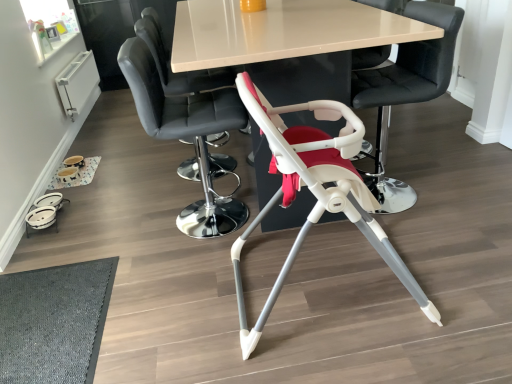
Question: Considering the relative sizes of smooth leather chair at upper center, which is the first chair in left-to-right order, and smooth black chair at center, which is the 3th chair in right-to-left order, in the image provided, is smooth leather chair at upper center, which is the first chair in left-to-right order, thinner than smooth black chair at center, which is the 3th chair in right-to-left order,?

Choices:
 (A) yes
 (B) no

Answer: (A)

Question: Can you confirm if smooth leather chair at upper center, the fourth chair when ordered from right to left, is taller than smooth black chair at center, which is the 3th chair in right-to-left order?

Choices:
 (A) yes
 (B) no

Answer: (A)

Question: Is smooth leather chair at upper center, the fourth chair when ordered from right to left, wider than smooth black chair at center, which is the 3th chair in right-to-left order?

Choices:
 (A) yes
 (B) no

Answer: (B)

Question: Is the position of smooth leather chair at upper center, which is the first chair in left-to-right order, more distant than that of smooth black chair at center, the second chair when ordered from left to right?

Choices:
 (A) yes
 (B) no

Answer: (A)

Question: Does smooth leather chair at upper center, the fourth chair when ordered from right to left, have a smaller size compared to smooth black chair at center, which is the 3th chair in right-to-left order?

Choices:
 (A) no
 (B) yes

Answer: (B)

Question: Looking at their shapes, would you say smooth black chair at center, the second chair when ordered from left to right, is wider or thinner than white glossy table at center?

Choices:
 (A) thin
 (B) wide

Answer: (A)

Question: Is smooth black chair at center, the second chair when ordered from left to right, in front of or behind white glossy table at center in the image?

Choices:
 (A) behind
 (B) front

Answer: (A)

Question: Looking at the image, does smooth black chair at center, which is the 3th chair in right-to-left order, seem bigger or smaller compared to white glossy table at center?

Choices:
 (A) big
 (B) small

Answer: (B)

Question: Visually, is smooth black chair at center, the second chair when ordered from left to right, positioned to the left or to the right of white glossy table at center?

Choices:
 (A) left
 (B) right

Answer: (A)

Question: Would you say white plastic highchair at center, acting as the fourth chair starting from the left, is to the left or to the right of white glossy table at center in the picture?

Choices:
 (A) right
 (B) left

Answer: (A)

Question: In terms of height, does white plastic highchair at center, acting as the fourth chair starting from the left, look taller or shorter compared to white glossy table at center?

Choices:
 (A) tall
 (B) short

Answer: (A)

Question: From a real-world perspective, relative to white glossy table at center, is white plastic highchair at center, acting as the fourth chair starting from the left, vertically above or below?

Choices:
 (A) above
 (B) below

Answer: (A)

Question: Based on their sizes in the image, would you say white plastic highchair at center, marked as the first chair in a right-to-left arrangement, is bigger or smaller than white glossy table at center?

Choices:
 (A) big
 (B) small

Answer: (B)

Question: In terms of height, does dark gray textured mat at lower left look taller or shorter compared to white plastic highchair at center, marked as the first chair in a right-to-left arrangement?

Choices:
 (A) short
 (B) tall

Answer: (A)

Question: In terms of size, does dark gray textured mat at lower left appear bigger or smaller than white plastic highchair at center, marked as the first chair in a right-to-left arrangement?

Choices:
 (A) big
 (B) small

Answer: (B)